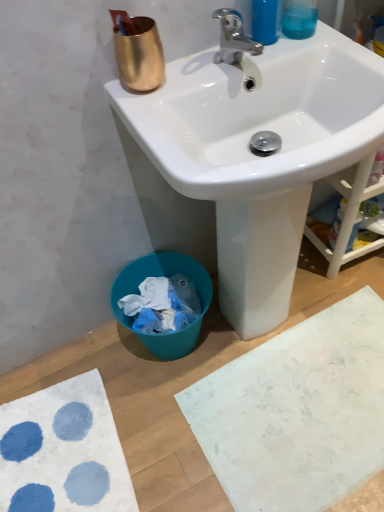
Where is `vacant area that lies between translucent blue liquid at upper right and chrome metallic faucet at upper center`? vacant area that lies between translucent blue liquid at upper right and chrome metallic faucet at upper center is located at coordinates (276, 51).